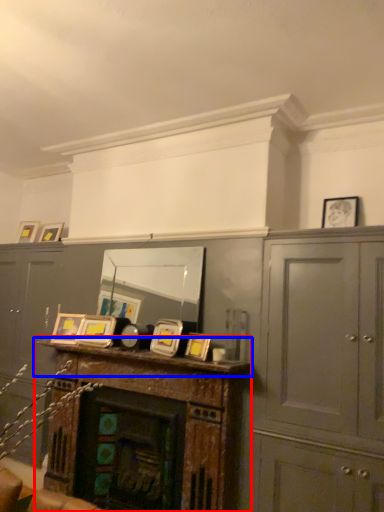
Question: Among these objects, which one is nearest to the camera, table (highlighted by a red box) or mantle (highlighted by a blue box)?

Choices:
 (A) table
 (B) mantle

Answer: (B)